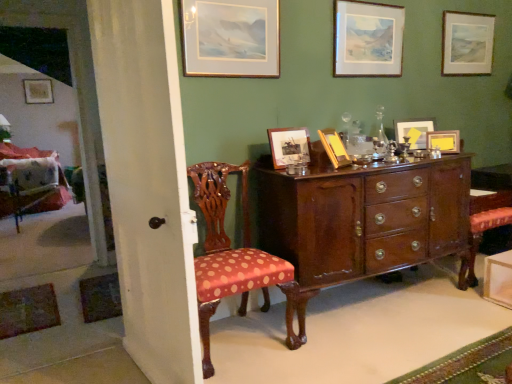
Locate an element on the screen. This screenshot has width=512, height=384. vacant space in front of polished wood cabinet at center is located at coordinates coord(381,345).